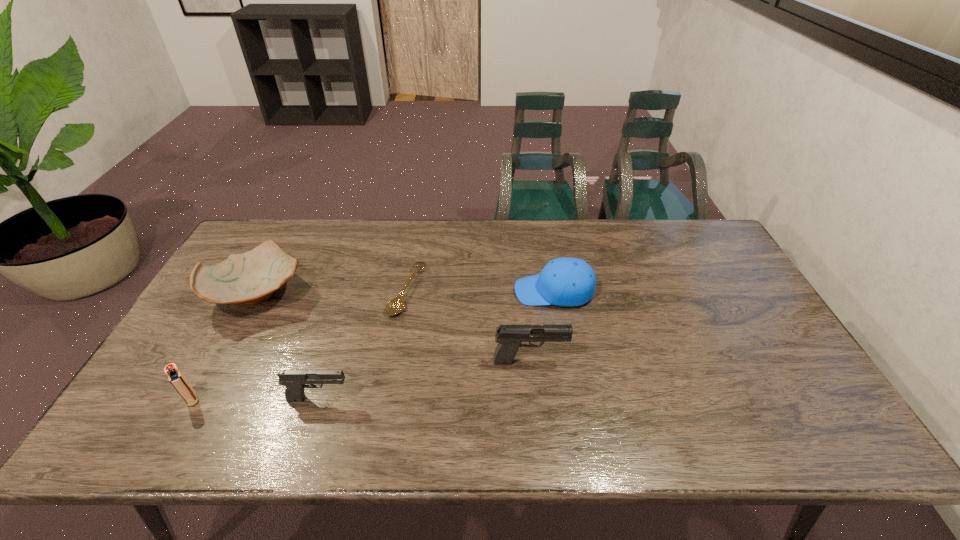
Find the location of a particular element. The width and height of the screenshot is (960, 540). free spot that satisfies the following two spatial constraints: 1. on the front-facing side of the cap; 2. on the front side of the pottery is located at coordinates (555, 293).